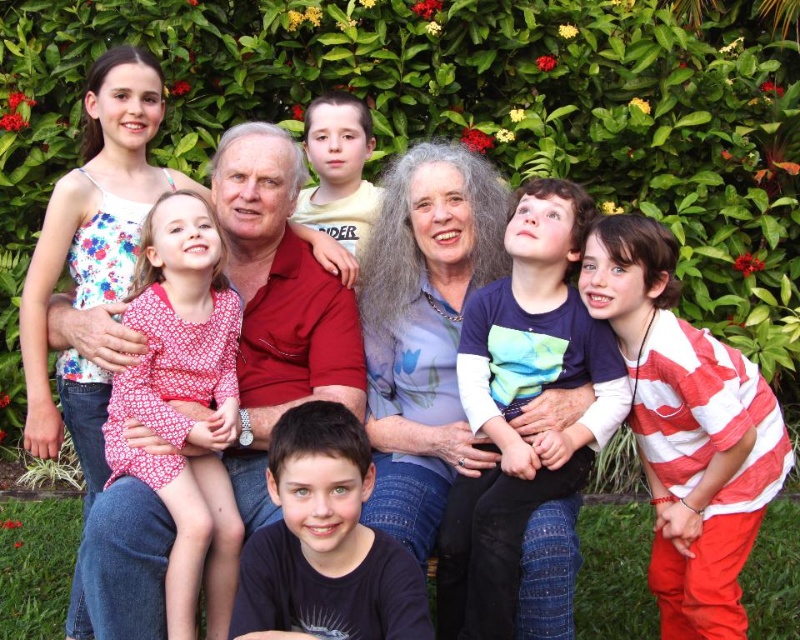
Can you confirm if white striped shirt at center right is positioned to the right of yellow cotton shirt at upper center?

Correct, you'll find white striped shirt at center right to the right of yellow cotton shirt at upper center.

Is white striped shirt at center right bigger than yellow cotton shirt at upper center?

Indeed, white striped shirt at center right has a larger size compared to yellow cotton shirt at upper center.

The image size is (800, 640). I want to click on white striped shirt at center right, so click(x=686, y=429).

In order to click on white striped shirt at center right in this screenshot , I will do `click(686, 429)`.

Can you confirm if white striped shirt at center right is positioned to the left of floral fabric blouse at center?

No, white striped shirt at center right is not to the left of floral fabric blouse at center.

Is white striped shirt at center right closer to camera compared to floral fabric blouse at center?

Yes.

I want to click on white striped shirt at center right, so click(x=686, y=429).

Based on the photo, who is higher up, floral fabric blouse at center or dark blue shirt at center?

floral fabric blouse at center is higher up.

Does floral fabric blouse at center have a smaller size compared to dark blue shirt at center?

No.

Is point (433, 458) less distant than point (362, 451)?

That is False.

The height and width of the screenshot is (640, 800). I want to click on floral fabric blouse at center, so click(424, 330).